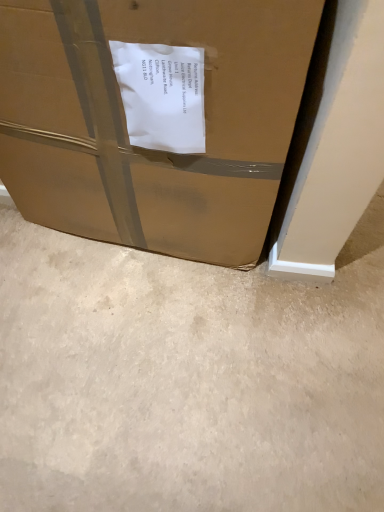
Question: Does beige carpet at lower center have a lesser width compared to brown cardboard box at lower left?

Choices:
 (A) no
 (B) yes

Answer: (A)

Question: Is beige carpet at lower center looking in the opposite direction of brown cardboard box at lower left?

Choices:
 (A) no
 (B) yes

Answer: (A)

Question: Is brown cardboard box at lower left a part of beige carpet at lower center?

Choices:
 (A) yes
 (B) no

Answer: (B)

Question: From a real-world perspective, is beige carpet at lower center located higher than brown cardboard box at lower left?

Choices:
 (A) yes
 (B) no

Answer: (B)

Question: Is beige carpet at lower center to the right of brown cardboard box at lower left from the viewer's perspective?

Choices:
 (A) no
 (B) yes

Answer: (B)

Question: Is beige carpet at lower center far away from brown cardboard box at lower left?

Choices:
 (A) no
 (B) yes

Answer: (A)

Question: Is brown cardboard box at lower left bigger than beige carpet at lower center?

Choices:
 (A) no
 (B) yes

Answer: (B)

Question: Is brown cardboard box at lower left positioned with its back to beige carpet at lower center?

Choices:
 (A) no
 (B) yes

Answer: (A)

Question: From a real-world perspective, is brown cardboard box at lower left over beige carpet at lower center?

Choices:
 (A) yes
 (B) no

Answer: (A)

Question: From a real-world perspective, does brown cardboard box at lower left sit lower than beige carpet at lower center?

Choices:
 (A) yes
 (B) no

Answer: (B)

Question: Is brown cardboard box at lower left located outside beige carpet at lower center?

Choices:
 (A) no
 (B) yes

Answer: (B)

Question: From the image's perspective, would you say brown cardboard box at lower left is positioned over beige carpet at lower center?

Choices:
 (A) no
 (B) yes

Answer: (B)

Question: Looking at their shapes, would you say beige carpet at lower center is wider or thinner than brown cardboard box at lower left?

Choices:
 (A) thin
 (B) wide

Answer: (B)